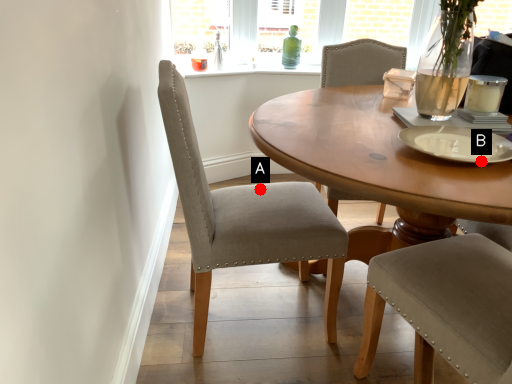
Question: Two points are circled on the image, labeled by A and B beside each circle. Which of the following is the farthest from the observer?

Choices:
 (A) A is further
 (B) B is further

Answer: (A)